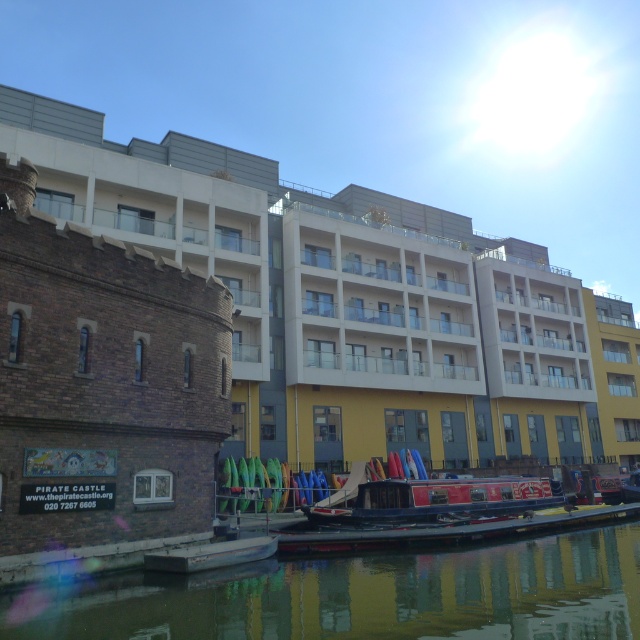
From the picture: Does smooth reflective water at center have a larger size compared to blue polished wood barge at center?

Indeed, smooth reflective water at center has a larger size compared to blue polished wood barge at center.

Based on the photo, is smooth reflective water at center to the right of blue polished wood barge at center from the viewer's perspective?

In fact, smooth reflective water at center is to the left of blue polished wood barge at center.

Is point (316, 577) farther from camera compared to point (433, 509)?

No, it is in front of (433, 509).

This screenshot has width=640, height=640. What are the coordinates of `smooth reflective water at center` in the screenshot? It's located at (362, 595).